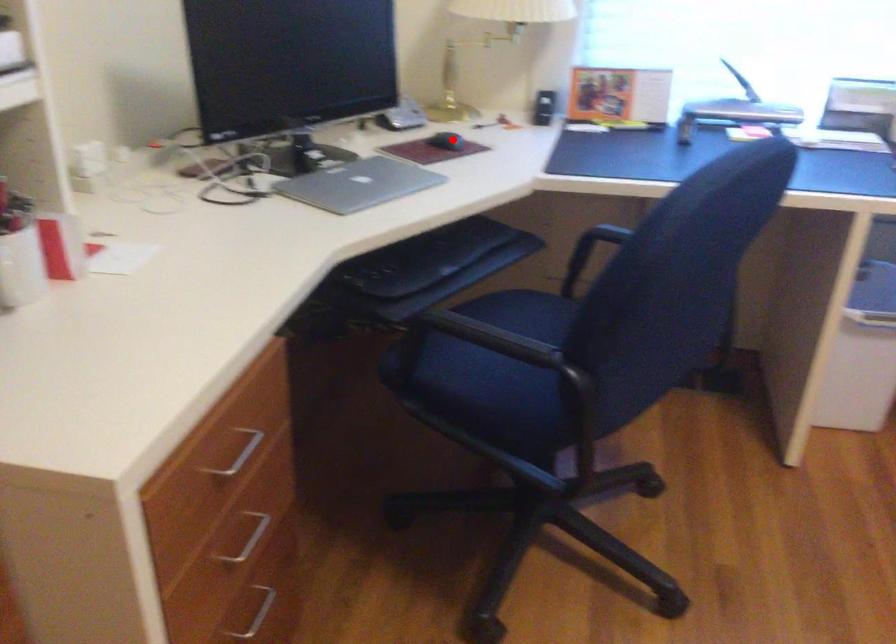
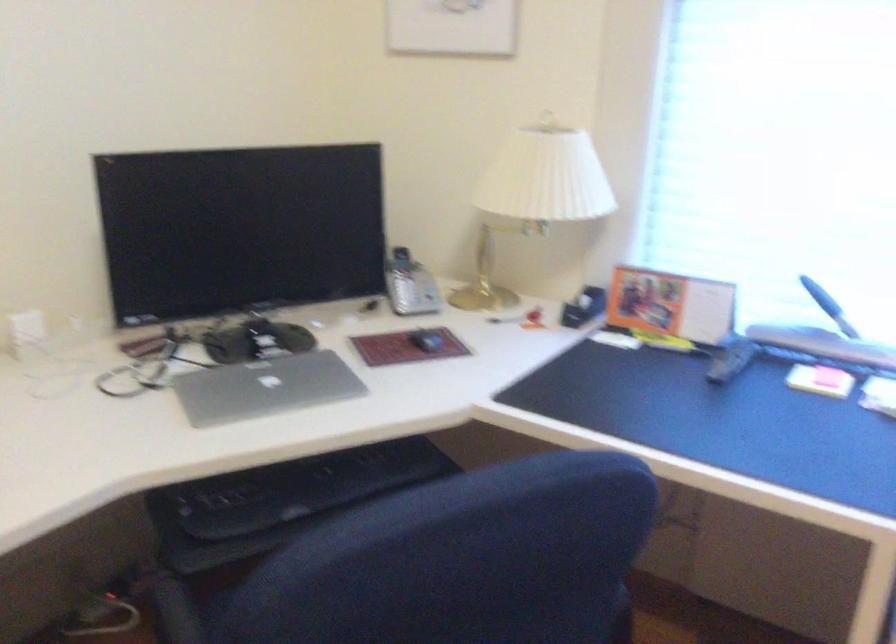
Question: I am providing you with two images of the same scene from different viewpoints. In image1, a red point is highlighted. Considering the same 3D point in image2, which of the following is correct?

Choices:
 (A) It is closer
 (B) It is farther

Answer: (A)